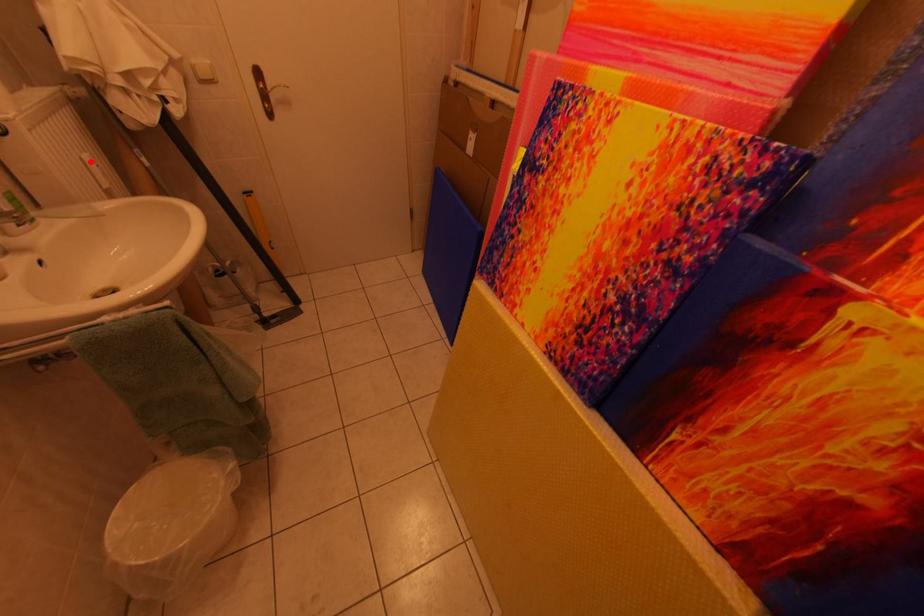
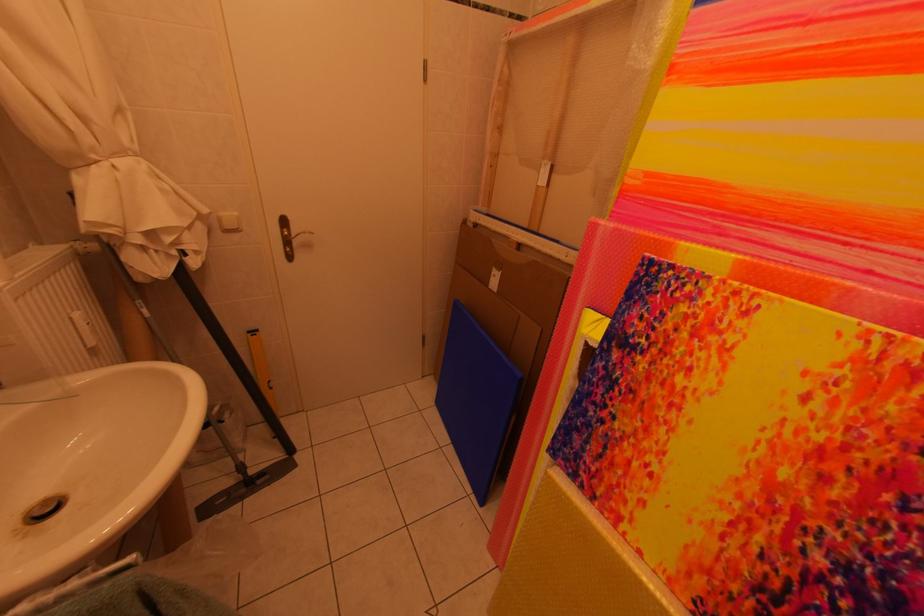
In the second image, find the point that corresponds to the highlighted location in the first image.

(79, 321)